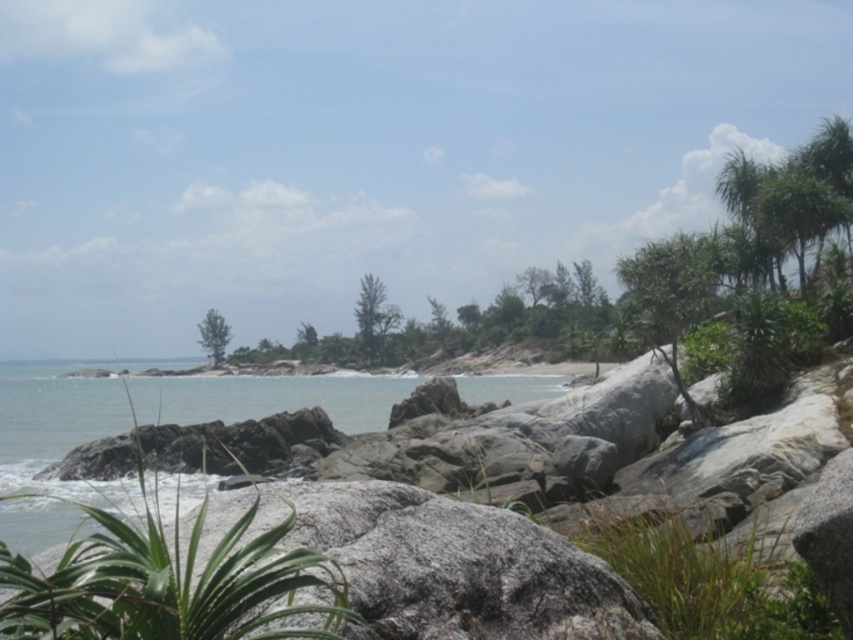
Can you confirm if clear water at center is positioned to the right of green leafy tree at center?

Indeed, clear water at center is positioned on the right side of green leafy tree at center.

Does clear water at center appear under green leafy tree at center?

Correct, clear water at center is located below green leafy tree at center.

Which is behind, point (357, 380) or point (215, 342)?

Point (215, 342)

You are a GUI agent. You are given a task and a screenshot of the screen. Output one action in this format:
    pyautogui.click(x=<x>, y=<y>)
    Task: Click on the clear water at center
    This screenshot has height=640, width=853.
    Given the screenshot: What is the action you would take?
    pyautogui.click(x=55, y=426)

Is green leafy palm tree at upper right closer to the viewer compared to green leafy tree at center?

Yes, it is.

Does green leafy palm tree at upper right have a lesser width compared to green leafy tree at center?

Correct, green leafy palm tree at upper right's width is less than green leafy tree at center's.

Which is behind, point (790, 212) or point (210, 346)?

The point (210, 346) is behind.

Image resolution: width=853 pixels, height=640 pixels. Identify the location of green leafy palm tree at upper right. (798, 212).

Is clear water at center above green leafy palm tree at upper right?

Actually, clear water at center is below green leafy palm tree at upper right.

Which is below, clear water at center or green leafy palm tree at upper right?

clear water at center

Is point (196, 480) farther from camera compared to point (811, 209)?

Yes, it is.

I want to click on clear water at center, so click(55, 426).